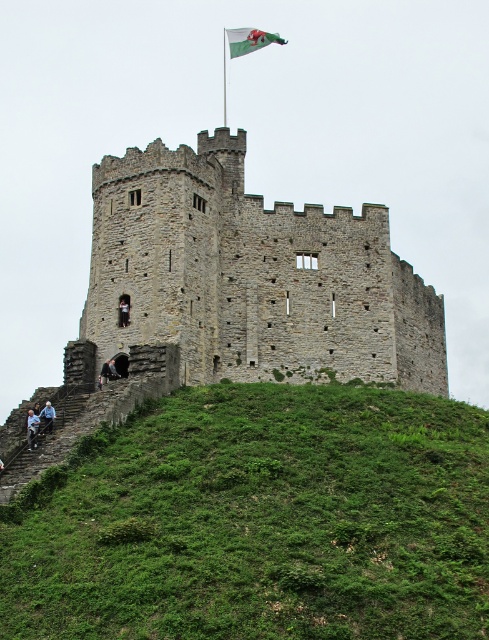
Question: Observing the image, what is the correct spatial positioning of light blue denim jacket at lower left in reference to dark gray stone person at center?

Choices:
 (A) left
 (B) right

Answer: (A)

Question: Estimate the real-world distances between objects in this image. Which object is closer to the dark gray stone person at center?

Choices:
 (A) gray stone castle at center
 (B) green grassy hillside at lower left
 (C) green fabric flag at upper center

Answer: (A)

Question: Which point is farther to the camera?

Choices:
 (A) green grassy hillside at lower left
 (B) gray stone castle at center

Answer: (B)

Question: Which point appears closest to the camera in this image?

Choices:
 (A) (123, 490)
 (B) (29, 426)
 (C) (44, 428)
 (D) (127, 300)

Answer: (A)

Question: Can you confirm if light blue denim jacket at lower left is positioned above dark gray stone person at center?

Choices:
 (A) no
 (B) yes

Answer: (A)

Question: Does light blue denim jacket at lower left lie behind dark gray stone person at center?

Choices:
 (A) no
 (B) yes

Answer: (A)